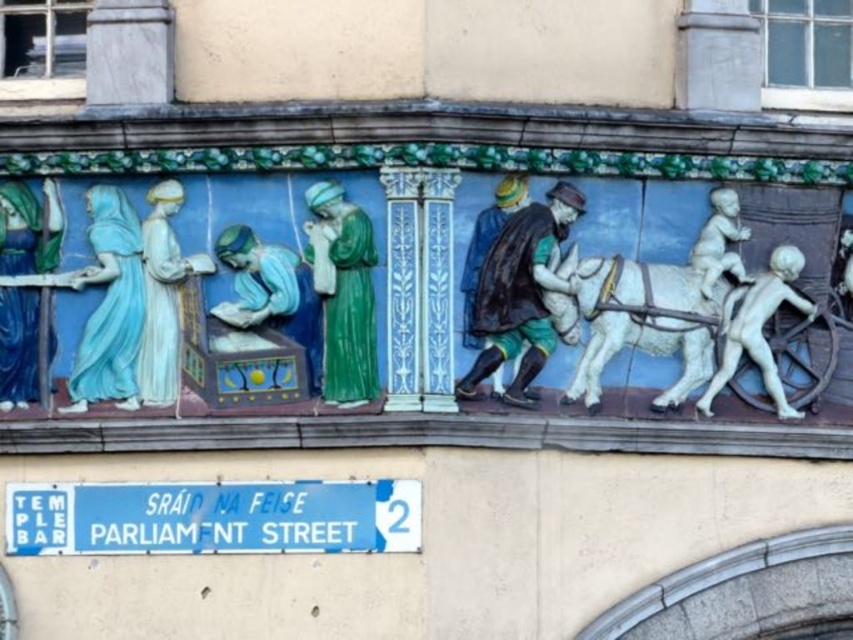
Question: Which object is farther from the camera taking this photo?

Choices:
 (A) green glazed ceramic figure at center
 (B) white glossy horse at center

Answer: (B)

Question: Can you confirm if blue plastic sign at lower center is positioned to the left of white marble children at right?

Choices:
 (A) yes
 (B) no

Answer: (A)

Question: Does white glossy horse at center appear on the right side of smooth white baby at center?

Choices:
 (A) no
 (B) yes

Answer: (A)

Question: Which object is the closest to the matte blue fabric at left?

Choices:
 (A) smooth white baby at center
 (B) matte black cape at center
 (C) blue plastic sign at lower center

Answer: (C)

Question: Which point appears closest to the camera in this image?

Choices:
 (A) (781, 268)
 (B) (206, 522)
 (C) (103, 336)
 (D) (369, 252)

Answer: (D)

Question: Can you confirm if green glazed ceramic figure at center is positioned above matte blue fabric at center?

Choices:
 (A) yes
 (B) no

Answer: (A)